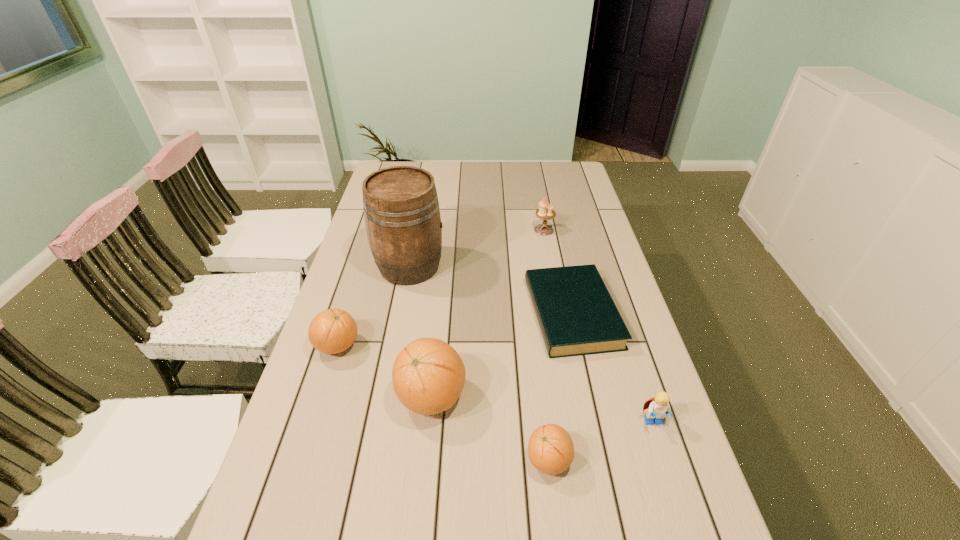
What are the coordinates of `the leftmost orange` in the screenshot? It's located at (332, 331).

Locate an element on the screen. the second tallest orange is located at coordinates (332, 331).

Locate an element on the screen. This screenshot has width=960, height=540. the tallest orange is located at coordinates (428, 375).

This screenshot has height=540, width=960. Find the location of `the second orange from right to left`. the second orange from right to left is located at coordinates (428, 375).

The width and height of the screenshot is (960, 540). Identify the location of the rightmost orange. (550, 448).

Where is `the nearest orange`? The width and height of the screenshot is (960, 540). the nearest orange is located at coordinates (550, 448).

The width and height of the screenshot is (960, 540). What are the coordinates of `the farthest object` in the screenshot? It's located at point(545,212).

The height and width of the screenshot is (540, 960). In order to click on the fifth shortest object in this screenshot , I will do `click(545, 212)`.

The image size is (960, 540). What are the coordinates of `the tallest object` in the screenshot? It's located at (401, 210).

The height and width of the screenshot is (540, 960). In order to click on book in this screenshot , I will do `click(576, 314)`.